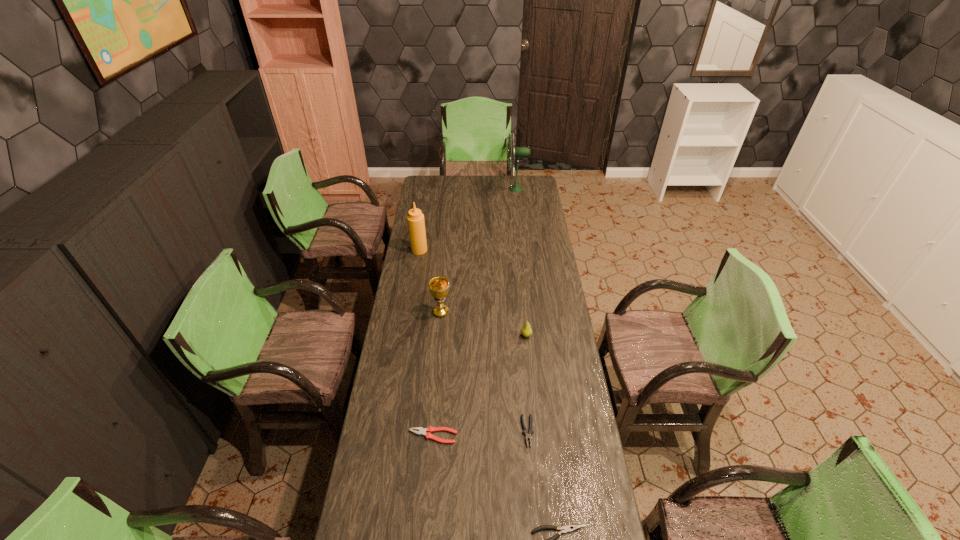
This screenshot has height=540, width=960. I want to click on blank space located 0.280m on the front-facing side of the farthest object, so click(x=461, y=188).

At what (x,y) coordinates should I click in order to perform the action: click on vacant position located 0.180m on the front-facing side of the farthest object. Please return your answer as a coordinate pair (x, y). This screenshot has height=540, width=960. Looking at the image, I should click on (477, 188).

The image size is (960, 540). I want to click on free space located on the front of the second tallest object, so click(x=416, y=271).

At what (x,y) coordinates should I click in order to perform the action: click on vacant point located on the back of the third tallest object. Please return your answer as a coordinate pair (x, y). Image resolution: width=960 pixels, height=540 pixels. Looking at the image, I should click on (444, 274).

Locate an element on the screen. The width and height of the screenshot is (960, 540). vacant area situated 0.360m on the front of the pear is located at coordinates (535, 418).

Locate an element on the screen. This screenshot has height=540, width=960. free space located 0.060m on the back of the leftmost pliers is located at coordinates (435, 412).

You are a GUI agent. You are given a task and a screenshot of the screen. Output one action in this format:
    pyautogui.click(x=<x>, y=<y>)
    Task: Click on the object that is at the far edge
    Image resolution: width=960 pixels, height=540 pixels.
    Given the screenshot: What is the action you would take?
    pyautogui.click(x=518, y=152)

Locate an element on the screen. condiment positioned at the left edge is located at coordinates (416, 225).

Image resolution: width=960 pixels, height=540 pixels. Find the location of `pliers that is at the left edge`. pliers that is at the left edge is located at coordinates (422, 431).

The image size is (960, 540). Identify the location of object that is at the right edge. (518, 152).